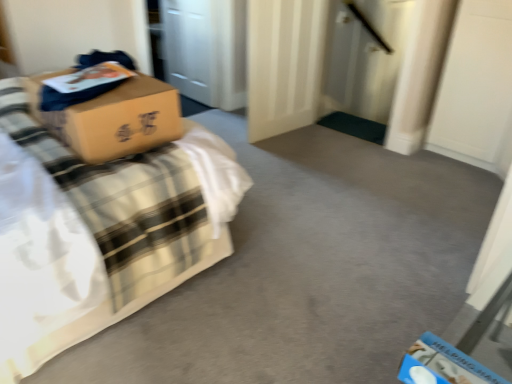
Question: From a real-world perspective, is matte cardboard box at upper left physically located above or below white matte door at center?

Choices:
 (A) above
 (B) below

Answer: (A)

Question: Is matte cardboard box at upper left wider or thinner than white matte door at center?

Choices:
 (A) wide
 (B) thin

Answer: (A)

Question: Considering the positions of point click(18, 86) and point click(283, 97), is point click(18, 86) closer or farther from the camera than point click(283, 97)?

Choices:
 (A) farther
 (B) closer

Answer: (B)

Question: Considering the positions of point (281, 132) and point (161, 205), is point (281, 132) closer or farther from the camera than point (161, 205)?

Choices:
 (A) closer
 (B) farther

Answer: (B)

Question: Considering the positions of white matte door at center and matte cardboard box at upper left in the image, is white matte door at center wider or thinner than matte cardboard box at upper left?

Choices:
 (A) wide
 (B) thin

Answer: (B)

Question: In terms of size, does white matte door at center appear bigger or smaller than matte cardboard box at upper left?

Choices:
 (A) small
 (B) big

Answer: (A)

Question: Relative to matte cardboard box at upper left, is white matte door at center in front or behind?

Choices:
 (A) behind
 (B) front

Answer: (A)